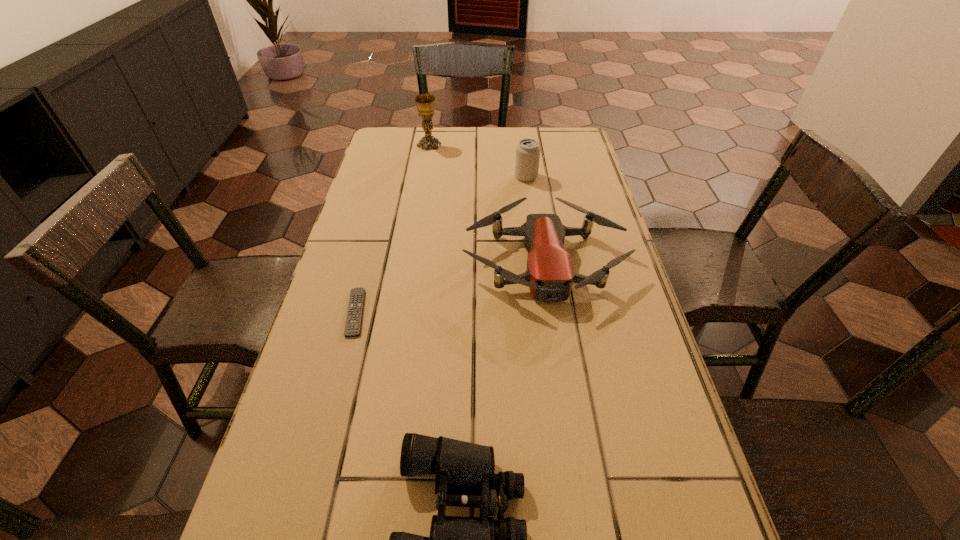
In order to click on vacant space at the far right corner of the desktop in this screenshot , I will do `click(571, 126)`.

The height and width of the screenshot is (540, 960). I want to click on vacant area between the fourth shortest object and the tallest object, so 478,161.

Locate an element on the screen. empty space between the third tallest object and the farthest object is located at coordinates (487, 203).

Find the location of `free space between the can and the tallest object`. free space between the can and the tallest object is located at coordinates (478, 161).

Find the location of a particular element. This screenshot has height=540, width=960. empty space between the shortest object and the third tallest object is located at coordinates (450, 287).

This screenshot has height=540, width=960. In order to click on free spot between the drone and the shortest object in this screenshot , I will do coord(450,287).

You are a GUI agent. You are given a task and a screenshot of the screen. Output one action in this format:
    pyautogui.click(x=<x>, y=<y>)
    Task: Click on the vacant point located between the third tallest object and the farthest object
    This screenshot has width=960, height=540.
    Given the screenshot: What is the action you would take?
    pyautogui.click(x=487, y=203)

Locate an element on the screen. object identified as the second closest to the leftmost object is located at coordinates (464, 473).

Select which object is the second closest to the second shortest object. Please provide its 2D coordinates. Your answer should be formatted as a tuple, i.e. [(x, y)], where the tuple contains the x and y coordinates of a point satisfying the conditions above.

[(550, 274)]

Identify the location of vacant region that satisfies the following two spatial constraints: 1. on the back side of the remote control; 2. on the right side of the chalice. This screenshot has width=960, height=540. (399, 145).